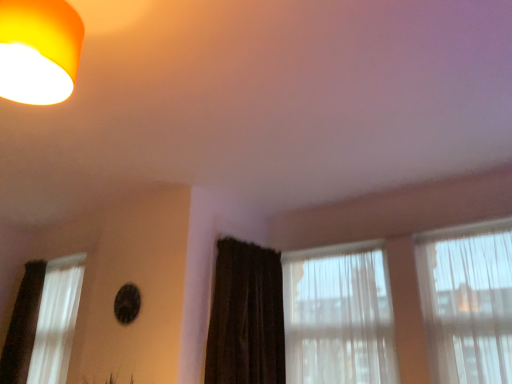
What do you see at coordinates (467, 301) in the screenshot?
I see `translucent fabric curtain at right, placed as the third window when sorted from left to right` at bounding box center [467, 301].

This screenshot has width=512, height=384. What do you see at coordinates (38, 50) in the screenshot? I see `matte orange lampshade at upper left` at bounding box center [38, 50].

At what (x,y) coordinates should I click in order to perform the action: click on translucent fabric curtain at center, positioned as the second window in right-to-left order. Please return your answer as a coordinate pair (x, y). Image resolution: width=512 pixels, height=384 pixels. Looking at the image, I should click on (339, 315).

Starting from the translucent fabric curtain at right, placed as the first window when sorted from right to left, which window is the 2nd one to the left? Please provide its 2D coordinates.

[(42, 322)]

Consider the image. Between translucent fabric curtain at right, placed as the third window when sorted from left to right, and white sheer curtain at left, the third window in the right-to-left sequence, which one is positioned in front?

translucent fabric curtain at right, placed as the third window when sorted from left to right, is in front.

Is translucent fabric curtain at right, placed as the third window when sorted from left to right, beside white sheer curtain at left, arranged as the first window when viewed from the left?

No, translucent fabric curtain at right, placed as the third window when sorted from left to right, is not touching white sheer curtain at left, arranged as the first window when viewed from the left.

What's the angular difference between translucent fabric curtain at right, placed as the first window when sorted from right to left, and matte orange lampshade at upper left's facing directions?

There is a 89.9-degree angle between the facing directions of translucent fabric curtain at right, placed as the first window when sorted from right to left, and matte orange lampshade at upper left.

Consider the image. From a real-world perspective, does translucent fabric curtain at right, placed as the first window when sorted from right to left, sit lower than matte orange lampshade at upper left?

Indeed, from a real-world perspective, translucent fabric curtain at right, placed as the first window when sorted from right to left, is positioned beneath matte orange lampshade at upper left.

Find the location of `the 2nd window to the right of the matte orange lampshade at upper left, counting from the anchor's position`. the 2nd window to the right of the matte orange lampshade at upper left, counting from the anchor's position is located at coordinates (467, 301).

Which of these two, translucent fabric curtain at right, placed as the first window when sorted from right to left, or matte orange lampshade at upper left, stands shorter?

matte orange lampshade at upper left.

In the scene shown: From their relative heights in the image, would you say matte orange lampshade at upper left is taller or shorter than dark brown textured curtain at center?

In the image, matte orange lampshade at upper left appears to be shorter than dark brown textured curtain at center.

Which of these two, matte orange lampshade at upper left or dark brown textured curtain at center, is smaller?

Smaller between the two is matte orange lampshade at upper left.

Is matte orange lampshade at upper left with dark brown textured curtain at center?

No, matte orange lampshade at upper left is not making contact with dark brown textured curtain at center.

Starting from the white sheer curtain at left, arranged as the first window when viewed from the left, which window is the 1st one to the right? Please provide its 2D coordinates.

[(339, 315)]

Can you confirm if white sheer curtain at left, arranged as the first window when viewed from the left, is smaller than translucent fabric curtain at center, positioned as the 2th window in left-to-right order?

Incorrect, white sheer curtain at left, arranged as the first window when viewed from the left, is not smaller in size than translucent fabric curtain at center, positioned as the 2th window in left-to-right order.

Which point is more forward, (81, 285) or (364, 358)?

Point (364, 358)

Could you measure the distance between white sheer curtain at left, the third window in the right-to-left sequence, and translucent fabric curtain at center, positioned as the 2th window in left-to-right order?

white sheer curtain at left, the third window in the right-to-left sequence, and translucent fabric curtain at center, positioned as the 2th window in left-to-right order, are 5.87 feet apart from each other.

Visually, is matte orange lampshade at upper left positioned to the left or to the right of translucent fabric curtain at center, positioned as the 2th window in left-to-right order?

matte orange lampshade at upper left is positioned on translucent fabric curtain at center, positioned as the 2th window in left-to-right order,'s left side.

From a real-world perspective, between matte orange lampshade at upper left and translucent fabric curtain at center, positioned as the second window in right-to-left order, who is vertically lower?

translucent fabric curtain at center, positioned as the second window in right-to-left order.

Which object is further away from the camera, matte orange lampshade at upper left or translucent fabric curtain at center, positioned as the 2th window in left-to-right order?

translucent fabric curtain at center, positioned as the 2th window in left-to-right order, is behind.

Can you tell me how much matte orange lampshade at upper left and translucent fabric curtain at center, positioned as the second window in right-to-left order, differ in facing direction?

89.9 degrees.

How distant is white sheer curtain at left, the third window in the right-to-left sequence, from translucent fabric curtain at right, placed as the third window when sorted from left to right?

The distance of white sheer curtain at left, the third window in the right-to-left sequence, from translucent fabric curtain at right, placed as the third window when sorted from left to right, is 8.45 feet.

Which object is more forward, white sheer curtain at left, arranged as the first window when viewed from the left, or translucent fabric curtain at right, placed as the first window when sorted from right to left?

translucent fabric curtain at right, placed as the first window when sorted from right to left, is more forward.

Is white sheer curtain at left, the third window in the right-to-left sequence, positioned with its back to translucent fabric curtain at right, placed as the first window when sorted from right to left?

No, translucent fabric curtain at right, placed as the first window when sorted from right to left, is not at the back of white sheer curtain at left, the third window in the right-to-left sequence.

From the image's perspective, who appears lower, dark brown textured curtain at center or white sheer curtain at left, the third window in the right-to-left sequence?

From the image's view, white sheer curtain at left, the third window in the right-to-left sequence, is below.

Is dark brown textured curtain at center inside or outside of white sheer curtain at left, arranged as the first window when viewed from the left?

dark brown textured curtain at center is located beyond the bounds of white sheer curtain at left, arranged as the first window when viewed from the left.

Find the location of a particular element. The image size is (512, 384). curtain in front of the white sheer curtain at left, the third window in the right-to-left sequence is located at coordinates (246, 316).

Identify the location of the 2nd window to the left when counting from the translucent fabric curtain at right, placed as the first window when sorted from right to left. Image resolution: width=512 pixels, height=384 pixels. (42, 322).

Starting from the matte orange lampshade at upper left, which window is the 2nd one to the right? Please provide its 2D coordinates.

[(467, 301)]

Considering their positions, is white sheer curtain at left, the third window in the right-to-left sequence, positioned closer to matte orange lampshade at upper left than translucent fabric curtain at right, placed as the third window when sorted from left to right?

translucent fabric curtain at right, placed as the third window when sorted from left to right, is positioned closer to the anchor matte orange lampshade at upper left.

Which object lies nearer to the anchor point translucent fabric curtain at right, placed as the first window when sorted from right to left, dark brown textured curtain at center or translucent fabric curtain at center, positioned as the second window in right-to-left order?

translucent fabric curtain at center, positioned as the second window in right-to-left order, lies closer to translucent fabric curtain at right, placed as the first window when sorted from right to left, than the other object.

Which object lies nearer to the anchor point matte orange lampshade at upper left, dark brown textured curtain at center or white sheer curtain at left, the third window in the right-to-left sequence?

dark brown textured curtain at center.

In the scene shown: From the image, which object appears to be nearer to translucent fabric curtain at center, positioned as the 2th window in left-to-right order, white sheer curtain at left, arranged as the first window when viewed from the left, or matte orange lampshade at upper left?

The object closer to translucent fabric curtain at center, positioned as the 2th window in left-to-right order, is white sheer curtain at left, arranged as the first window when viewed from the left.

Based on their spatial positions, is translucent fabric curtain at center, positioned as the second window in right-to-left order, or translucent fabric curtain at right, placed as the first window when sorted from right to left, further from matte orange lampshade at upper left?

The object further to matte orange lampshade at upper left is translucent fabric curtain at right, placed as the first window when sorted from right to left.

Looking at the image, which one is located further to dark brown textured curtain at center, white sheer curtain at left, arranged as the first window when viewed from the left, or translucent fabric curtain at center, positioned as the 2th window in left-to-right order?

Based on the image, white sheer curtain at left, arranged as the first window when viewed from the left, appears to be further to dark brown textured curtain at center.

Which object lies nearer to the anchor point white sheer curtain at left, arranged as the first window when viewed from the left, translucent fabric curtain at right, placed as the third window when sorted from left to right, or matte orange lampshade at upper left?

matte orange lampshade at upper left.

Looking at the image, which one is located further to matte orange lampshade at upper left, dark brown textured curtain at center or translucent fabric curtain at right, placed as the third window when sorted from left to right?

Based on the image, translucent fabric curtain at right, placed as the third window when sorted from left to right, appears to be further to matte orange lampshade at upper left.

At what (x,y) coordinates should I click in order to perform the action: click on curtain positioned between matte orange lampshade at upper left and white sheer curtain at left, arranged as the first window when viewed from the left, from near to far. Please return your answer as a coordinate pair (x, y). The width and height of the screenshot is (512, 384). Looking at the image, I should click on (246, 316).

This screenshot has height=384, width=512. I want to click on curtain positioned between matte orange lampshade at upper left and translucent fabric curtain at center, positioned as the second window in right-to-left order, from near to far, so click(x=246, y=316).

I want to click on lamp between white sheer curtain at left, the third window in the right-to-left sequence, and translucent fabric curtain at right, placed as the first window when sorted from right to left, so click(38, 50).

The height and width of the screenshot is (384, 512). I want to click on window between white sheer curtain at left, the third window in the right-to-left sequence, and translucent fabric curtain at right, placed as the third window when sorted from left to right, from left to right, so click(x=339, y=315).